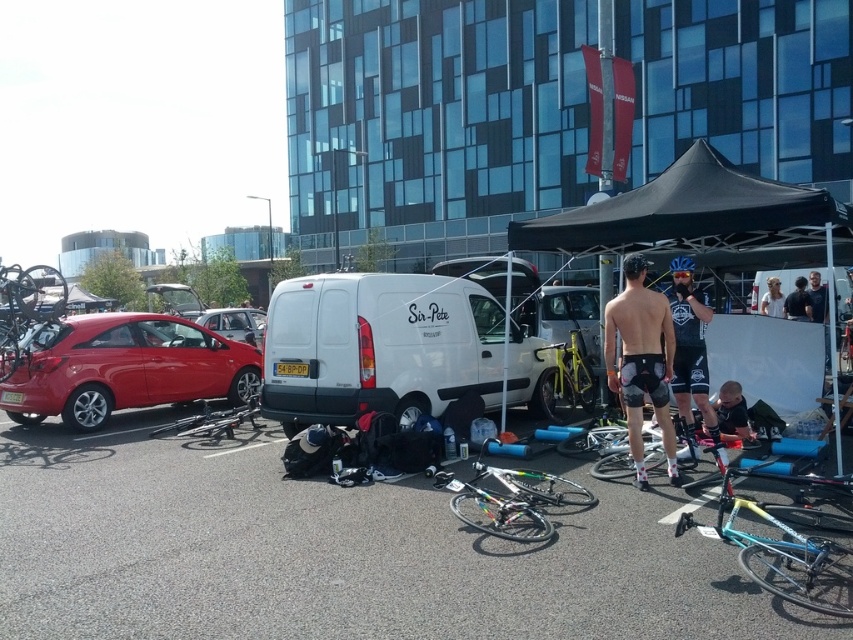
At what (x,y) coordinates should I click in order to perform the action: click on yellow metallic bicycle at center. Please return your answer as a coordinate pair (x, y). Looking at the image, I should click on (567, 380).

Which is in front, point (590, 410) or point (251, 324)?

Point (590, 410) is more forward.

Find the location of `yellow metallic bicycle at center`. yellow metallic bicycle at center is located at coordinates (567, 380).

Consider the image. Is shiny blue helmet at center shorter than white fabric shirt at upper right?

Incorrect, shiny blue helmet at center's height does not fall short of white fabric shirt at upper right's.

Is shiny blue helmet at center closer to the viewer compared to white fabric shirt at upper right?

That is True.

Who is more forward, (703, 371) or (775, 289)?

Point (703, 371) is in front.

Where is `shiny blue helmet at center`? This screenshot has height=640, width=853. shiny blue helmet at center is located at coordinates (689, 346).

Who is taller, shiny black bicycle at center or dark blue fabric shirt at lower right?

dark blue fabric shirt at lower right is taller.

Which is behind, point (241, 406) or point (726, 419)?

The point (241, 406) is behind.

Who is more forward, (x=210, y=422) or (x=734, y=400)?

Point (x=734, y=400)

The image size is (853, 640). In order to click on shiny black bicycle at center in this screenshot , I will do `click(212, 420)`.